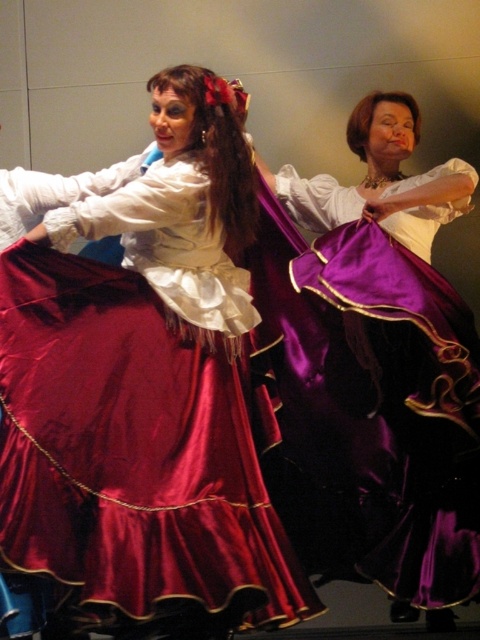
Based on the scene description, where is the satin dress at center located in terms of coordinates?

The satin dress at center is located at point [144,390].